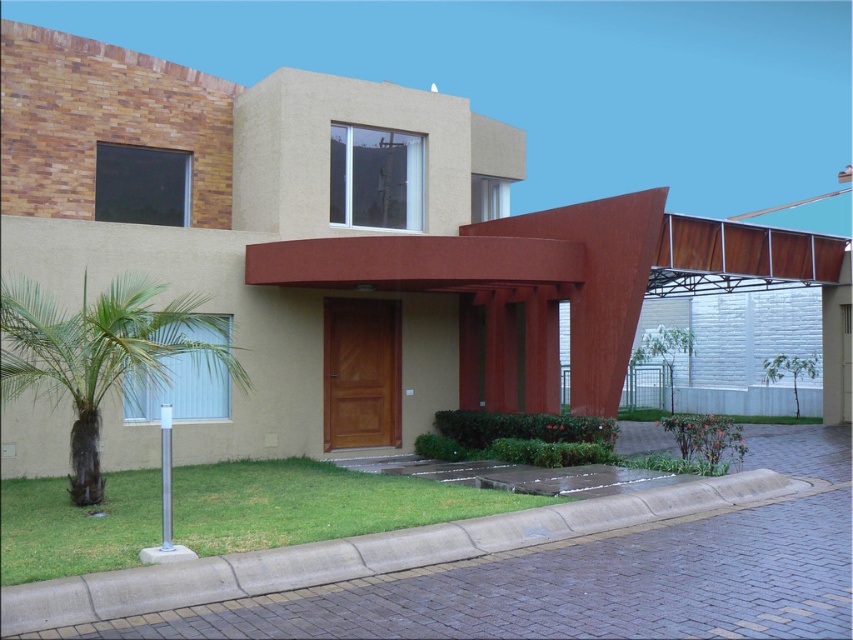
Is point (432, 483) farther from viewer compared to point (131, 349)?

Yes, point (432, 483) is farther from viewer.

Does green grass at lower center have a smaller size compared to green leafy palm tree at lower left?

Correct, green grass at lower center occupies less space than green leafy palm tree at lower left.

The height and width of the screenshot is (640, 853). In order to click on green grass at lower center in this screenshot , I will do `click(314, 502)`.

Identify the location of green grass at lower center. (314, 502).

Can you confirm if gray concrete curb at lower center is positioned to the left of green leafy palm tree at lower left?

Incorrect, gray concrete curb at lower center is not on the left side of green leafy palm tree at lower left.

Between gray concrete curb at lower center and green leafy palm tree at lower left, which one is positioned higher?

green leafy palm tree at lower left is higher up.

Does point (804, 488) come in front of point (106, 392)?

Yes, it is in front of point (106, 392).

The image size is (853, 640). What are the coordinates of `gray concrete curb at lower center` in the screenshot? It's located at (367, 554).

From the picture: Which is above, green grass at lower center or gray concrete curb at lower center?

Positioned higher is green grass at lower center.

In the scene shown: Can you confirm if green grass at lower center is positioned to the right of gray concrete curb at lower center?

Incorrect, green grass at lower center is not on the right side of gray concrete curb at lower center.

Is point (415, 506) more distant than point (68, 620)?

Yes, point (415, 506) is behind point (68, 620).

The image size is (853, 640). I want to click on green grass at lower center, so click(314, 502).